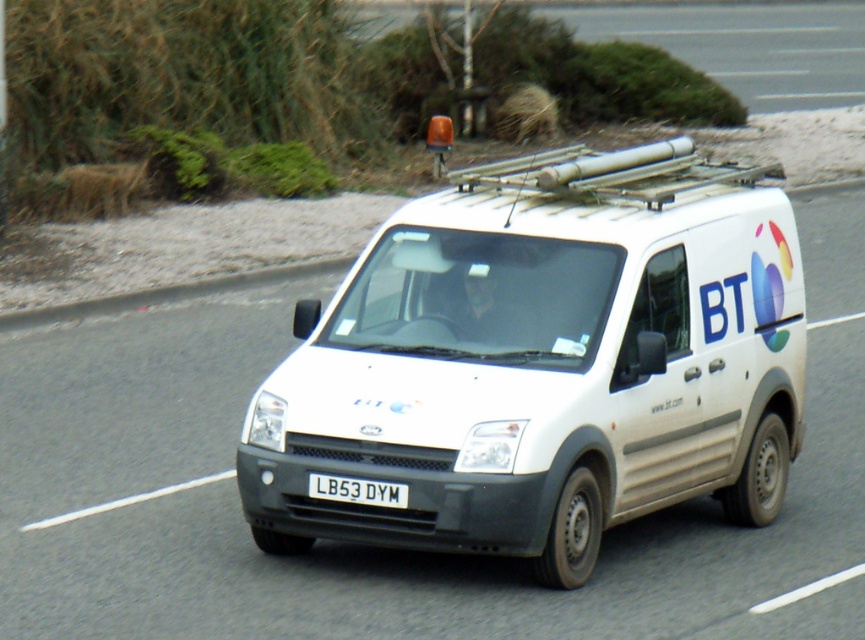
You are a traffic officer checking vehicle dimensions. The road has a width restriction that only allows vehicles up to 2 meters wide. You observe the white matte van at center and the white plastic license plate at center. Can the van pass through the restricted area based on its width compared to the license plate?

The white matte van at center is wider than the white plastic license plate at center, but without knowing the exact width of the license plate, it is impossible to determine if the van meets the 2 meter restriction. Additional measurements are needed.

Consider the image. You are a traffic officer observing a vehicle on the road. You notice the white matte van at center and the white plastic license plate at center. Which object is larger?

The white matte van at center is bigger than the white plastic license plate at center.